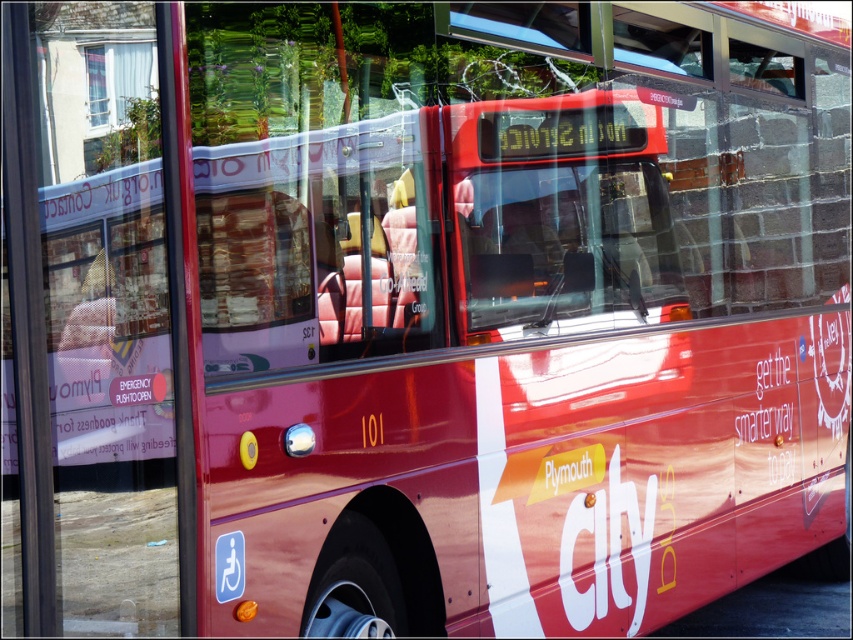
Question: Does glossy red bus at center have a larger size compared to transparent glass window at upper center?

Choices:
 (A) no
 (B) yes

Answer: (B)

Question: Considering the relative positions of glossy red bus at center and transparent glass window at upper center in the image provided, where is glossy red bus at center located with respect to transparent glass window at upper center?

Choices:
 (A) above
 (B) below

Answer: (B)

Question: Which of the following is the closest to the observer?

Choices:
 (A) (97, 100)
 (B) (114, 74)
 (C) (624, 13)

Answer: (A)

Question: Which of the following is the closest to the observer?

Choices:
 (A) (53, 480)
 (B) (640, 20)

Answer: (A)

Question: Can you confirm if glossy red bus at center is wider than transparent glass window at upper center?

Choices:
 (A) no
 (B) yes

Answer: (B)

Question: Which point is closer to the camera?

Choices:
 (A) (107, 86)
 (B) (637, 58)

Answer: (A)